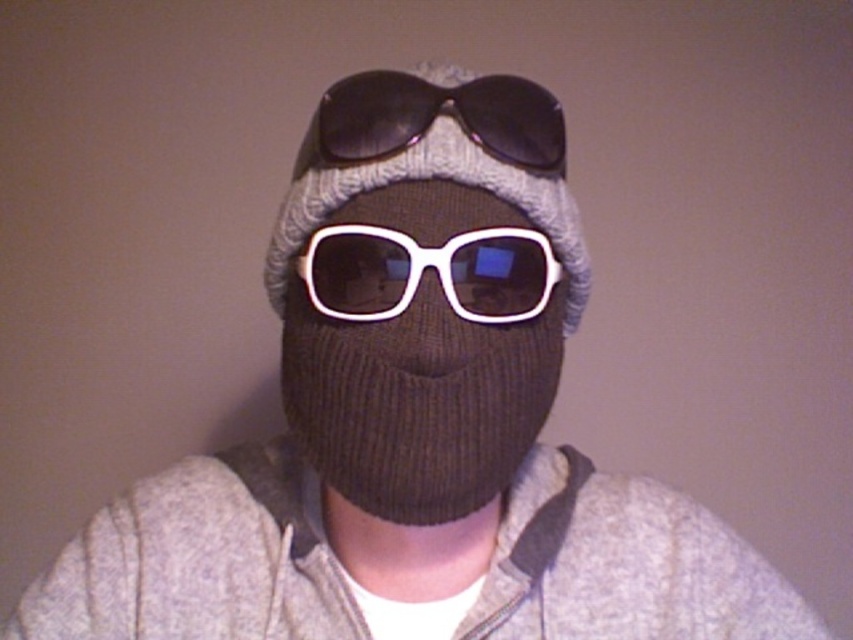
You are a photographer adjusting the focus on your camera. You notice two points in the image at coordinates point (523,305) and point (381,134). Which point should you focus on first to ensure the subject is sharp?

You should focus on point (523,305) first because it is closer to the camera than point (381,134).